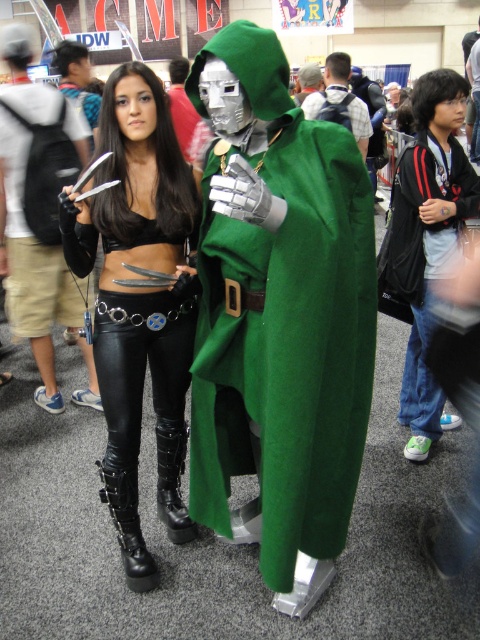
You are an attendee at the convention and want to take a photo with both the green woolen cloak at center and the black leather pants at center. Which one should you stand closer to if you want both to appear in your frame without moving them?

You should stand closer to the black leather pants at center because the green woolen cloak at center is to the right of the black leather pants at center, so positioning yourself closer to the black leather pants at center will help include both in the frame.